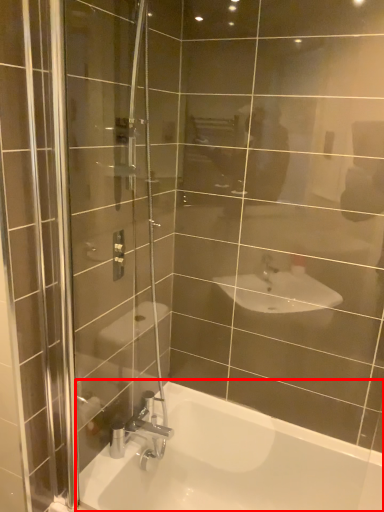
Question: Considering the relative positions of bathtub (annotated by the red box) and shower in the image provided, where is bathtub (annotated by the red box) located with respect to the staircase?

Choices:
 (A) left
 (B) right

Answer: (B)